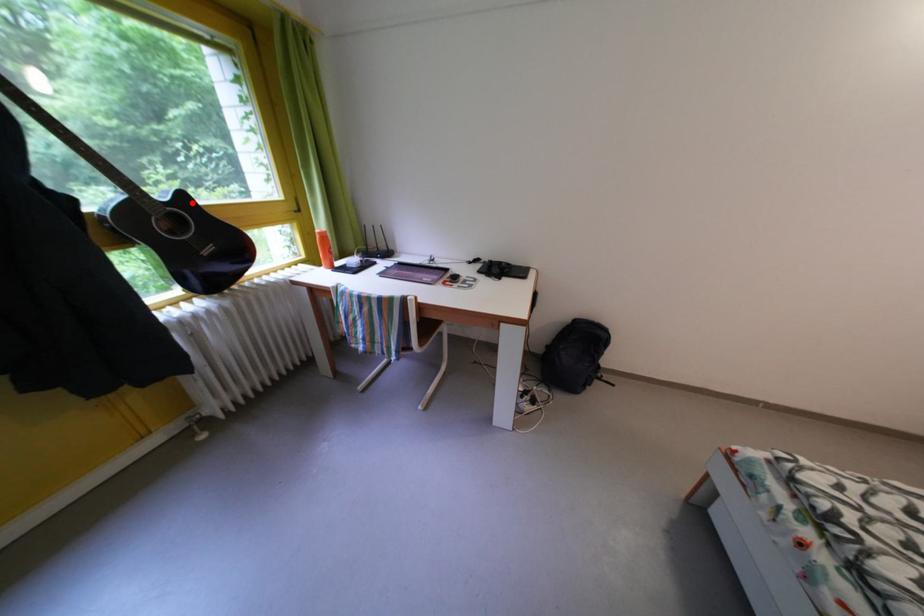
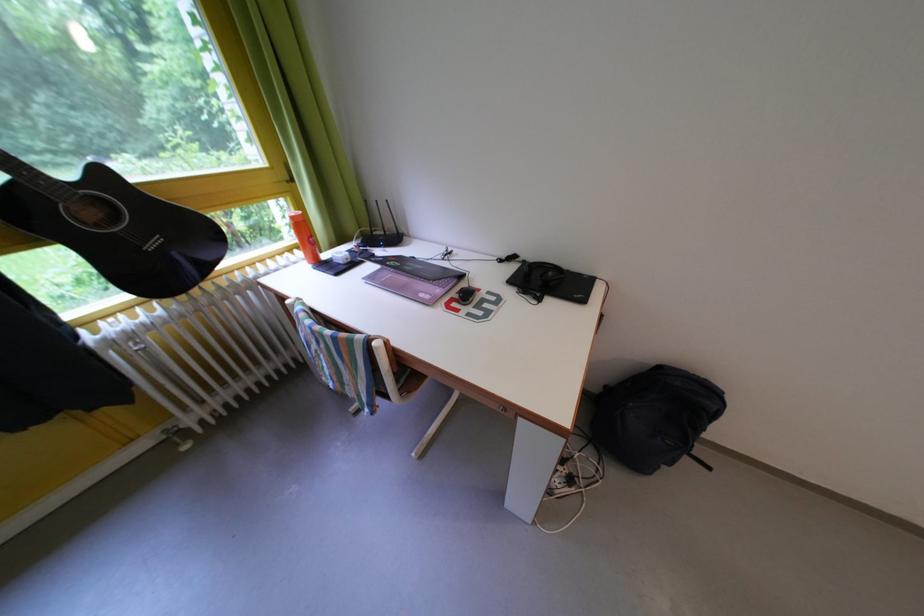
Question: A red point is marked in image1. In image2, is the corresponding 3D point closer to the camera or farther? Reply with the corresponding letter.

Choices:
 (A) The corresponding 3D point is closer.
 (B) The corresponding 3D point is farther.

Answer: (A)